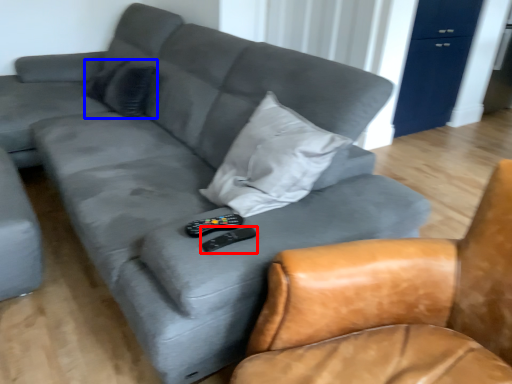
Question: Which object is closer to the camera taking this photo, remote (highlighted by a red box) or pillow (highlighted by a blue box)?

Choices:
 (A) remote
 (B) pillow

Answer: (A)